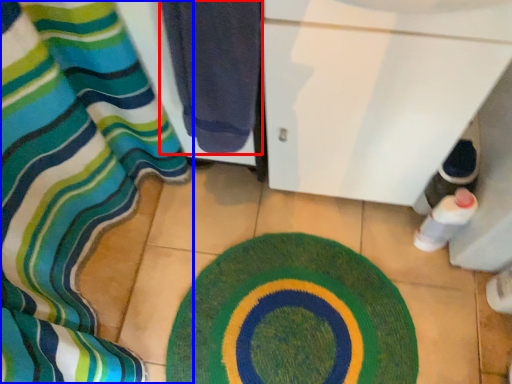
Question: Which object appears farthest to the camera in this image, towel (highlighted by a red box) or curtain (highlighted by a blue box)?

Choices:
 (A) towel
 (B) curtain

Answer: (B)